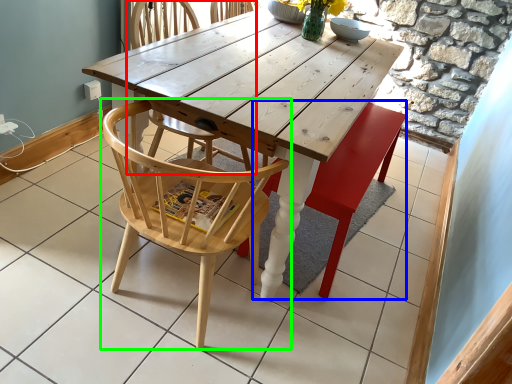
Question: Which object is the farthest from chair (highlighted by a red box)? Choose among these: swivel chair (highlighted by a blue box) or chair (highlighted by a green box).

Choices:
 (A) swivel chair
 (B) chair

Answer: (A)